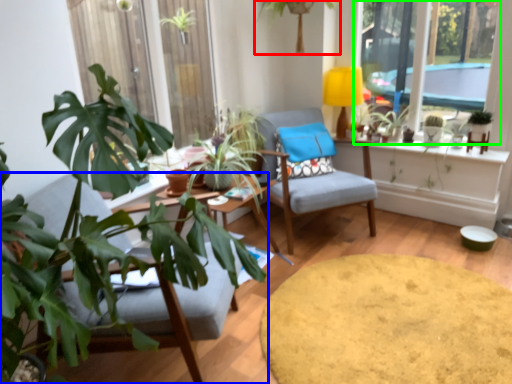
Question: Which object is positioned farthest from houseplant (highlighted by a red box)? Select from chair (highlighted by a blue box) and window (highlighted by a green box).

Choices:
 (A) chair
 (B) window

Answer: (A)